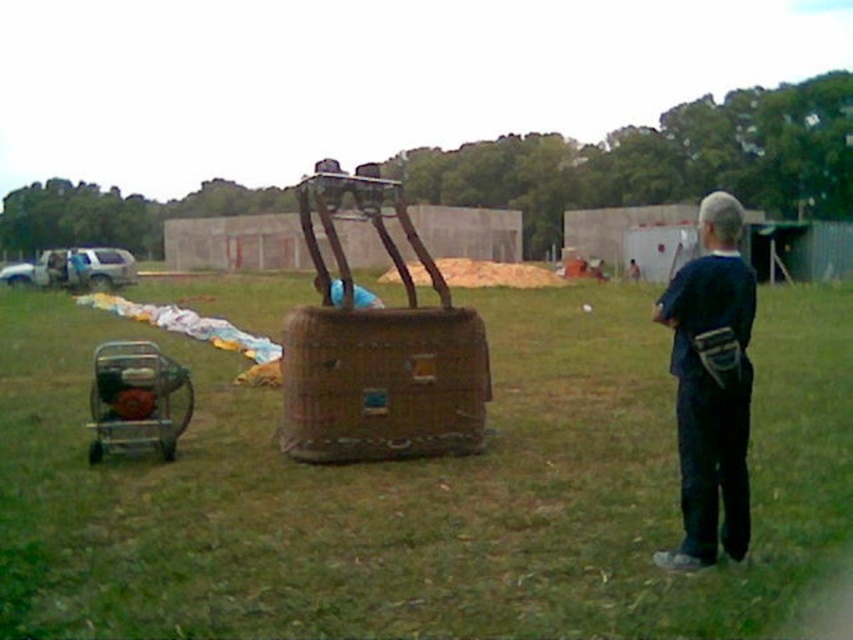
Question: Among these objects, which one is nearest to the camera?

Choices:
 (A) green grass at center
 (B) woven brown basket at center
 (C) blue fabric at center
 (D) brushed metal cart at lower left

Answer: (A)

Question: Considering the relative positions of woven brown basket at center and blue fabric at center in the image provided, where is woven brown basket at center located with respect to blue fabric at center?

Choices:
 (A) below
 (B) above

Answer: (A)

Question: Which object is closer to the camera taking this photo?

Choices:
 (A) dark blue shirt at right
 (B) brushed metal cart at lower left
 (C) woven brown basket at center

Answer: (A)

Question: In this image, where is green grass at center located relative to woven brown basket at center?

Choices:
 (A) above
 (B) below

Answer: (A)

Question: Which point is farther to the camera?

Choices:
 (A) 142,362
 (B) 706,518
 (C) 628,508
 (D) 299,362

Answer: (A)

Question: Can you confirm if woven brown basket at center is positioned to the right of blue fabric at center?

Choices:
 (A) yes
 (B) no

Answer: (A)